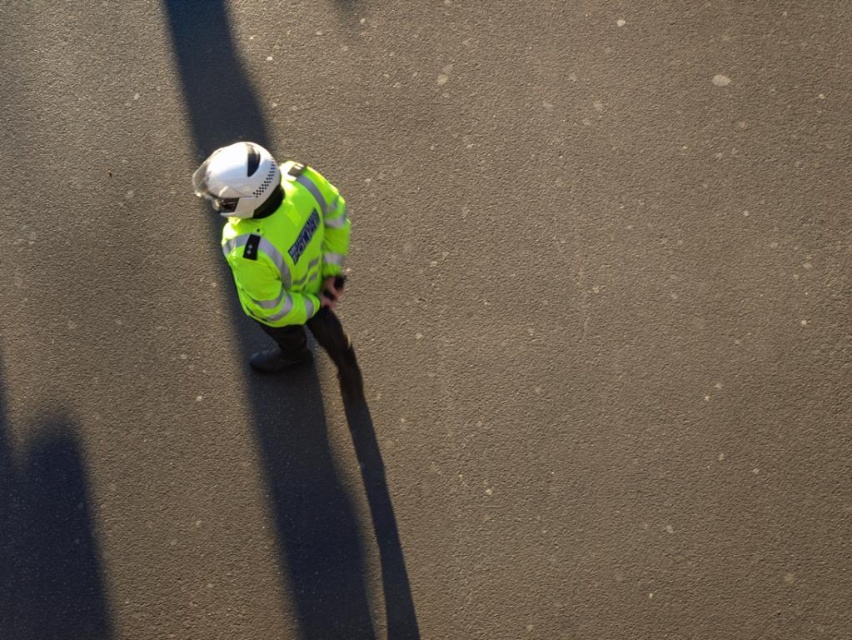
Does high-visibility fabric jacket at center appear under high-visibility fabric safety vest at center?

Yes, high-visibility fabric jacket at center is below high-visibility fabric safety vest at center.

Is high-visibility fabric jacket at center thinner than high-visibility fabric safety vest at center?

Incorrect, high-visibility fabric jacket at center's width is not less than high-visibility fabric safety vest at center's.

Between point (277, 236) and point (291, 224), which one is positioned in front?

Point (277, 236) is more forward.

This screenshot has width=852, height=640. I want to click on high-visibility fabric jacket at center, so click(281, 252).